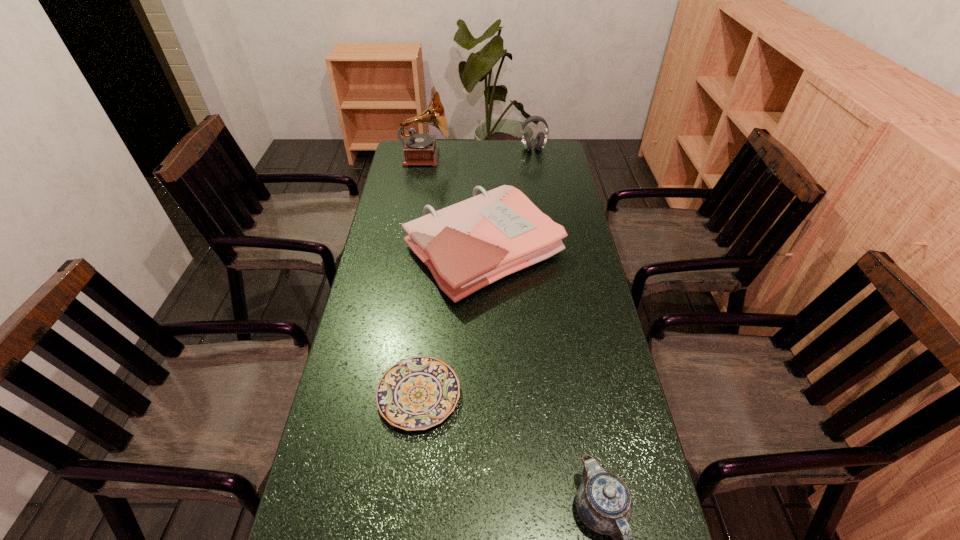
Locate an element on the screen. The width and height of the screenshot is (960, 540). headset at the far edge is located at coordinates (541, 138).

The height and width of the screenshot is (540, 960). Identify the location of phonograph_record positioned at the left edge. (419, 149).

You are a GUI agent. You are given a task and a screenshot of the screen. Output one action in this format:
    pyautogui.click(x=<x>, y=<y>)
    Task: Click on the phonebook located at the left edge
    The width and height of the screenshot is (960, 540).
    Given the screenshot: What is the action you would take?
    pyautogui.click(x=466, y=246)

This screenshot has height=540, width=960. In order to click on plate that is at the left edge in this screenshot , I will do `click(417, 393)`.

Where is `headset at the right edge`? headset at the right edge is located at coordinates (541, 138).

The image size is (960, 540). Find the location of `phonebook that is at the right edge`. phonebook that is at the right edge is located at coordinates (466, 246).

At what (x,y) coordinates should I click in order to perform the action: click on object present at the far left corner. Please return your answer as a coordinate pair (x, y). This screenshot has width=960, height=540. Looking at the image, I should click on (419, 149).

This screenshot has width=960, height=540. I want to click on object at the far right corner, so pos(541,138).

Identify the location of vacant region at the far edge of the desktop. (499, 152).

Where is `free spot at the left edge of the desktop`? free spot at the left edge of the desktop is located at coordinates (390, 192).